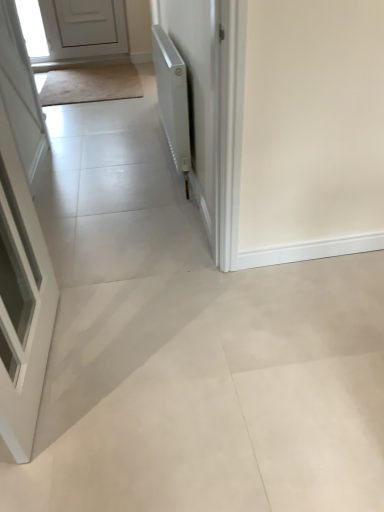
Locate an element on the screen. This screenshot has height=512, width=384. white glossy door at left, the first door positioned from the right is located at coordinates (21, 245).

This screenshot has width=384, height=512. Identify the location of mat below the white glossy door at left, positioned as the second door in top-to-bottom order (from a real-world perspective). (91, 84).

From the image's perspective, is beige carpet at upper left beneath white glossy door at left, placed as the first door when sorted from bottom to top?

No, from the image's perspective, beige carpet at upper left is not beneath white glossy door at left, placed as the first door when sorted from bottom to top.

Based on the photo, can you confirm if beige carpet at upper left is smaller than white glossy door at left, placed as the first door when sorted from bottom to top?

Indeed, beige carpet at upper left has a smaller size compared to white glossy door at left, placed as the first door when sorted from bottom to top.

Is beige carpet at upper left far from white glossy door at left, positioned as the second door in top-to-bottom order?

Yes, beige carpet at upper left and white glossy door at left, positioned as the second door in top-to-bottom order, are located far from each other.

Considering the positions of point (173, 117) and point (77, 41), is point (173, 117) closer or farther from the camera than point (77, 41)?

Point (173, 117) appears to be closer to the viewer than point (77, 41).

Is white matte radiator at upper right facing away from white matte door at upper left, arranged as the second door when viewed from the front?

No, white matte door at upper left, arranged as the second door when viewed from the front, is not at the back of white matte radiator at upper right.

How distant is white matte radiator at upper right from white matte door at upper left, which appears as the second door when viewed from the right?

white matte radiator at upper right is 2.45 meters away from white matte door at upper left, which appears as the second door when viewed from the right.

Is white matte radiator at upper right next to white matte door at upper left, acting as the first door starting from the top, and touching it?

No, white matte radiator at upper right is not touching white matte door at upper left, acting as the first door starting from the top.

Between white glossy door at left, placed as the 2th door when sorted from left to right, and white matte radiator at upper right, which one has more height?

white glossy door at left, placed as the 2th door when sorted from left to right.

Relative to white matte radiator at upper right, is white glossy door at left, the first door positioned from the right, in front or behind?

white glossy door at left, the first door positioned from the right, is in front of white matte radiator at upper right.

Considering the relative sizes of white glossy door at left, which is counted as the first door, starting from the front, and white matte radiator at upper right in the image provided, is white glossy door at left, which is counted as the first door, starting from the front, bigger than white matte radiator at upper right?

No, white glossy door at left, which is counted as the first door, starting from the front, is not bigger than white matte radiator at upper right.

Looking at this image, which is farther from the camera, (16, 279) or (161, 114)?

Point (161, 114)

Is point (14, 234) more distant than point (52, 96)?

That is False.

Which object is wider, white glossy door at left, placed as the 2th door when sorted from left to right, or beige carpet at upper left?

beige carpet at upper left.

Measure the distance from white glossy door at left, which is counted as the first door, starting from the front, to beige carpet at upper left.

They are 4.25 feet apart.

Is white glossy door at left, which is counted as the first door, starting from the front, directly adjacent to beige carpet at upper left?

A: white glossy door at left, which is counted as the first door, starting from the front, is not next to beige carpet at upper left, and they're not touching.

From their relative heights in the image, would you say white matte door at upper left, arranged as the second door when viewed from the front, is taller or shorter than white glossy door at left, placed as the first door when sorted from bottom to top?

Clearly, white matte door at upper left, arranged as the second door when viewed from the front, is shorter compared to white glossy door at left, placed as the first door when sorted from bottom to top.

Is white matte door at upper left, the first door from the left, facing towards white glossy door at left, placed as the 2th door when sorted from left to right?

Yes, white matte door at upper left, the first door from the left, is facing white glossy door at left, placed as the 2th door when sorted from left to right.

From the image's perspective, which one is positioned higher, white matte door at upper left, arranged as the second door when viewed from the front, or white glossy door at left, the first door positioned from the right?

white matte door at upper left, arranged as the second door when viewed from the front, from the image's perspective.

Considering the sizes of white matte door at upper left, which is the 2th door from bottom to top, and white glossy door at left, the first door positioned from the right, in the image, is white matte door at upper left, which is the 2th door from bottom to top, wider or thinner than white glossy door at left, the first door positioned from the right,?

Considering their sizes, white matte door at upper left, which is the 2th door from bottom to top, looks broader than white glossy door at left, the first door positioned from the right.

Considering the relative sizes of white matte radiator at upper right and beige carpet at upper left in the image provided, is white matte radiator at upper right shorter than beige carpet at upper left?

No, white matte radiator at upper right is not shorter than beige carpet at upper left.

Is white matte radiator at upper right looking in the opposite direction of beige carpet at upper left?

That's not correct — white matte radiator at upper right is not looking away from beige carpet at upper left.

Consider the image. From a real-world perspective, which is physically below, white matte radiator at upper right or beige carpet at upper left?

In real-world perspective, beige carpet at upper left is lower.

Considering the points (185, 123) and (30, 102), which point is behind, point (185, 123) or point (30, 102)?

Positioned behind is point (30, 102).

Between white matte radiator at upper right and white glossy door at left, which appears as the 2th door when viewed from the back, which one has smaller size?

With smaller size is white glossy door at left, which appears as the 2th door when viewed from the back.

Is the position of white matte radiator at upper right more distant than that of white glossy door at left, which appears as the 2th door when viewed from the back?

Yes, it is.

Is white matte radiator at upper right next to white glossy door at left, placed as the 2th door when sorted from left to right, and touching it?

white matte radiator at upper right and white glossy door at left, placed as the 2th door when sorted from left to right, are not in contact.

From a real-world perspective, starting from the beige carpet at upper left, which door is the 2nd one vertically above it? Please provide its 2D coordinates.

[(21, 245)]

Where is `radiator on the right of the white matte door at upper left, which appears as the second door when viewed from the right`? This screenshot has height=512, width=384. radiator on the right of the white matte door at upper left, which appears as the second door when viewed from the right is located at coordinates (172, 99).

Which object lies nearer to the anchor point white glossy door at left, which appears as the 2th door when viewed from the back, beige carpet at upper left or white matte radiator at upper right?

white matte radiator at upper right lies closer to white glossy door at left, which appears as the 2th door when viewed from the back, than the other object.

Based on their spatial positions, is beige carpet at upper left or white matte door at upper left, the first door from the left, further from white glossy door at left, the first door positioned from the right?

white matte door at upper left, the first door from the left, is further to white glossy door at left, the first door positioned from the right.

Considering their positions, is white matte radiator at upper right positioned closer to white glossy door at left, placed as the 2th door when sorted from left to right, than white matte door at upper left, arranged as the second door when viewed from the front?

white matte radiator at upper right lies closer to white glossy door at left, placed as the 2th door when sorted from left to right, than the other object.

From the image, which object appears to be farther from beige carpet at upper left, white matte radiator at upper right or white glossy door at left, which appears as the 2th door when viewed from the back?

white matte radiator at upper right is positioned further to the anchor beige carpet at upper left.

Which object lies further to the anchor point white matte radiator at upper right, white glossy door at left, the first door positioned from the right, or white matte door at upper left, acting as the first door starting from the top?

Based on the image, white matte door at upper left, acting as the first door starting from the top, appears to be further to white matte radiator at upper right.

From the image, which object appears to be farther from white glossy door at left, positioned as the second door in top-to-bottom order, white matte door at upper left, the first door from the left, or white matte radiator at upper right?

white matte door at upper left, the first door from the left, is positioned further to the anchor white glossy door at left, positioned as the second door in top-to-bottom order.

From the image, which object appears to be farther from white matte radiator at upper right, beige carpet at upper left or white matte door at upper left, which appears as the second door when viewed from the right?

The object further to white matte radiator at upper right is white matte door at upper left, which appears as the second door when viewed from the right.

Estimate the real-world distances between objects in this image. Which object is further from beige carpet at upper left, white glossy door at left, the first door positioned from the right, or white matte radiator at upper right?

Among the two, white matte radiator at upper right is located further to beige carpet at upper left.

Find the location of a particular element. Image resolution: width=384 pixels, height=512 pixels. mat located between white matte radiator at upper right and white matte door at upper left, placed as the first door when sorted from back to front, in the depth direction is located at coordinates (91, 84).

I want to click on radiator between white glossy door at left, which is counted as the first door, starting from the front, and beige carpet at upper left from front to back, so click(172, 99).

The image size is (384, 512). What are the coordinates of `radiator positioned between white glossy door at left, which appears as the 2th door when viewed from the back, and white matte door at upper left, the first door from the left, from near to far` in the screenshot? It's located at (172, 99).

What are the coordinates of `mat positioned between white glossy door at left, placed as the first door when sorted from bottom to top, and white matte door at upper left, which is the 2th door from bottom to top, from near to far` in the screenshot? It's located at (91, 84).